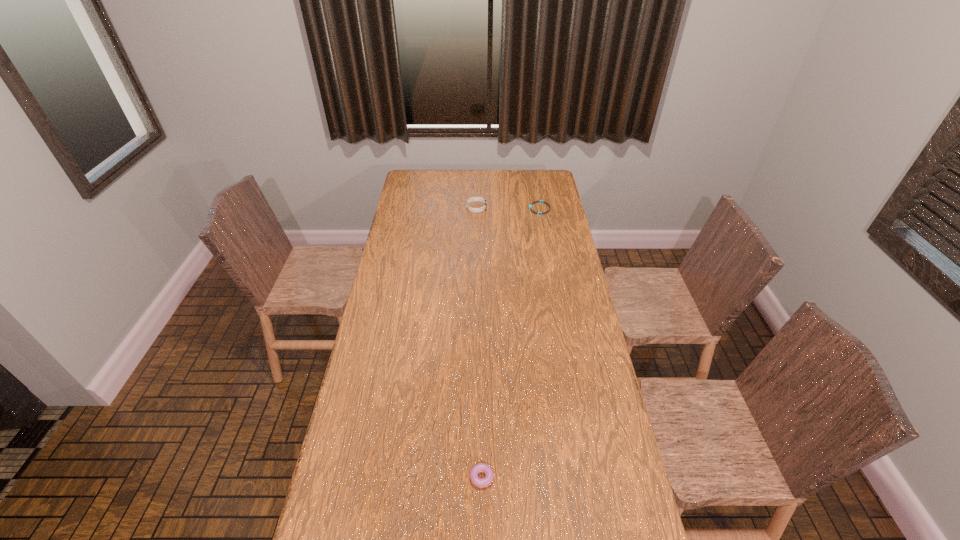
This screenshot has height=540, width=960. I want to click on free space between the shortest object and the tallest object, so click(x=508, y=208).

Identify the location of free area in between the shorter wristband and the taller wristband. The height and width of the screenshot is (540, 960). (508, 208).

Identify the location of vacant space that's between the tallest object and the right wristband. (508, 208).

Locate an element on the screen. free point between the taller wristband and the rightmost object is located at coordinates (508, 208).

Where is `unoccupied position between the right wristband and the second shortest object`? The width and height of the screenshot is (960, 540). unoccupied position between the right wristband and the second shortest object is located at coordinates (511, 342).

You are a GUI agent. You are given a task and a screenshot of the screen. Output one action in this format:
    pyautogui.click(x=<x>, y=<y>)
    Task: Click on the free space between the shortest object and the taller wristband
    Image resolution: width=960 pixels, height=540 pixels.
    Given the screenshot: What is the action you would take?
    tap(508, 208)

In order to click on empty space between the taller wristband and the second tallest object in this screenshot , I will do `click(479, 341)`.

Identify the location of object that stands as the closest to the nearest object. (475, 210).

Where is `object identified as the closest to the left wristband`? object identified as the closest to the left wristband is located at coordinates (540, 201).

Locate an element on the screen. The image size is (960, 540). blank area in the image that satisfies the following two spatial constraints: 1. on the outer surface of the taller wristband; 2. on the left side of the nearest object is located at coordinates (473, 475).